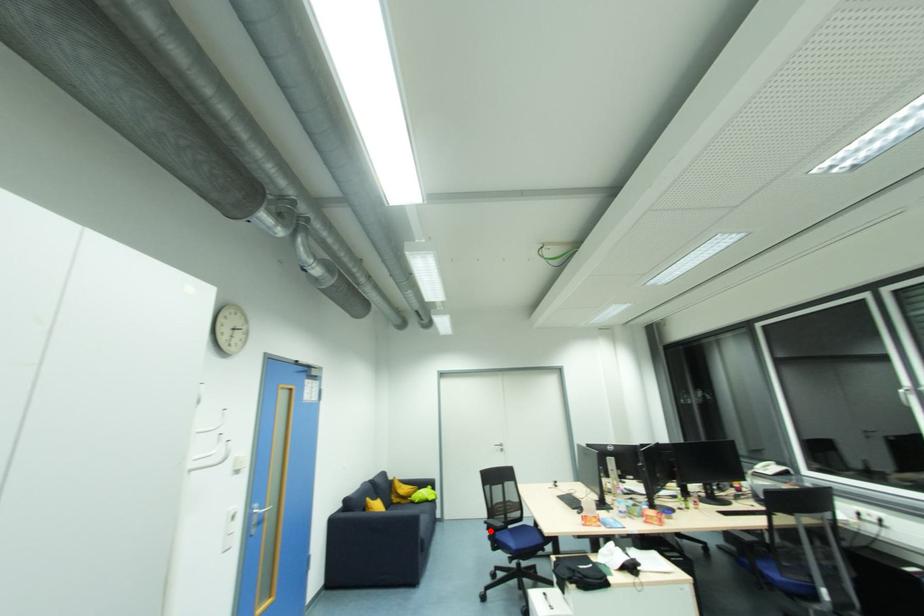
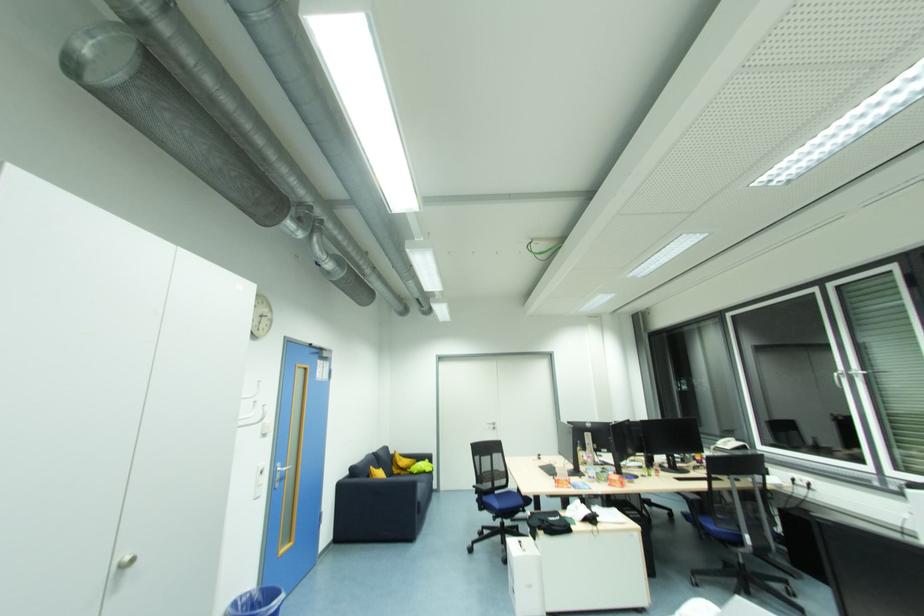
The point at the highlighted location is marked in the first image. Where is the corresponding point in the second image?

(480, 493)